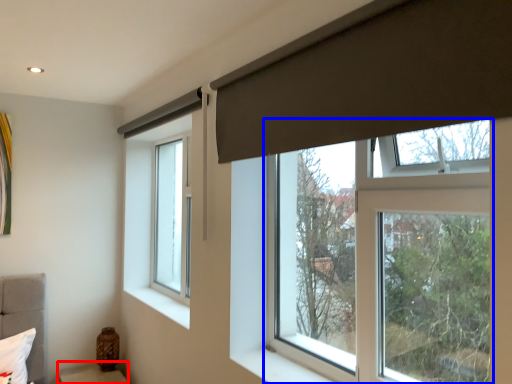
Question: Which of the following is the closest to the observer, furniture (highlighted by a red box) or window (highlighted by a blue box)?

Choices:
 (A) furniture
 (B) window

Answer: (B)